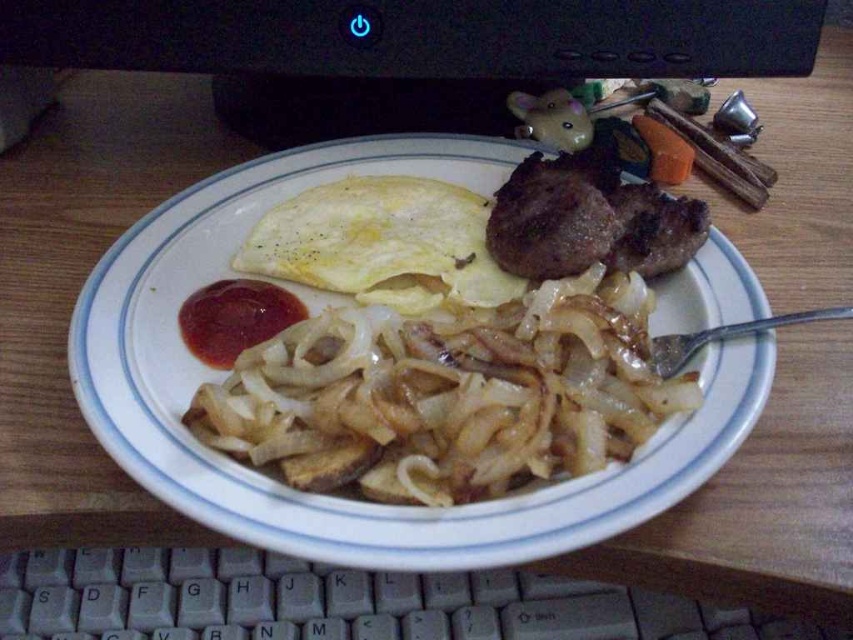
Question: Among these objects, which one is farthest from the camera?

Choices:
 (A) white glazed plate at center
 (B) white plastic keyboard at lower center
 (C) red glossy ketchup at center
 (D) orange smooth carrot at upper right

Answer: (D)

Question: Among these points, which one is farthest from the camera?

Choices:
 (A) (663, 358)
 (B) (154, 316)
 (C) (164, 636)

Answer: (C)

Question: Where is translucent caramelized pasta at center located in relation to orange smooth carrot at upper right in the image?

Choices:
 (A) above
 (B) below

Answer: (B)

Question: Which of the following is the closest to the observer?

Choices:
 (A) red glossy ketchup at center
 (B) orange smooth carrot at upper right
 (C) white glazed plate at center
 (D) silver metallic fork at lower right

Answer: (C)

Question: Is translucent caramelized pasta at center behind orange smooth carrot at upper right?

Choices:
 (A) no
 (B) yes

Answer: (A)

Question: Does black plastic computer monitor at upper center lie behind orange smooth carrot at upper right?

Choices:
 (A) yes
 (B) no

Answer: (B)